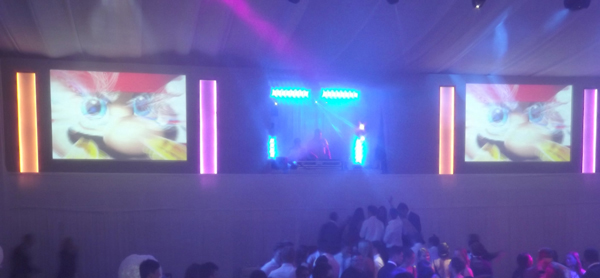
Where is `orange light on wall`? orange light on wall is located at coordinates (27, 152), (440, 155).